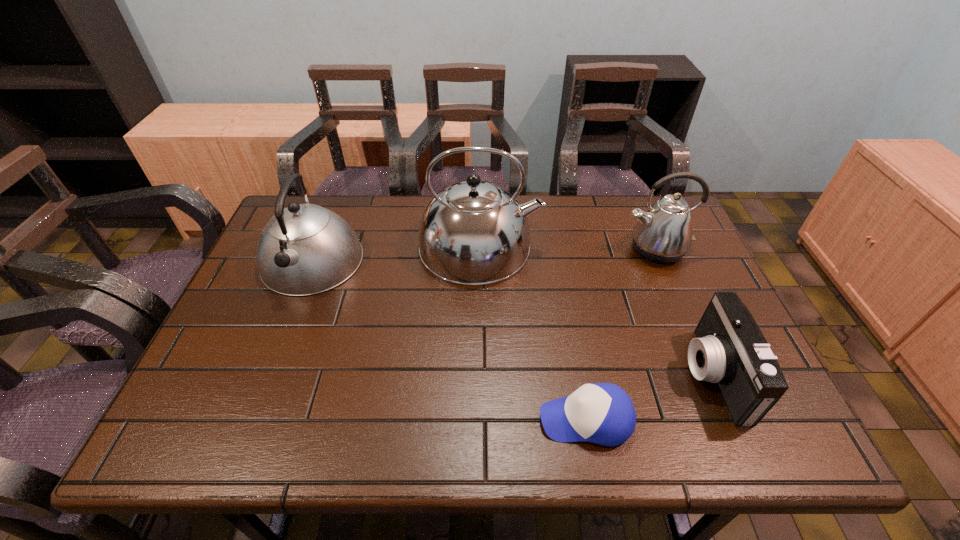
Identify the location of free spot between the leftmost object and the second shortest object. The width and height of the screenshot is (960, 540). (513, 318).

This screenshot has width=960, height=540. What are the coordinates of `unoccupied position between the rightmost kettle and the camcorder` in the screenshot? It's located at pos(684,312).

Locate an element on the screen. free spot between the leftmost kettle and the second shortest object is located at coordinates (513, 318).

This screenshot has height=540, width=960. I want to click on vacant area between the fourth tallest object and the second kettle from right to left, so click(596, 310).

Where is `vacant space that's between the leftmost object and the shortest object`? vacant space that's between the leftmost object and the shortest object is located at coordinates (448, 340).

In order to click on vacant area between the leftmost object and the shortest object in this screenshot , I will do `click(448, 340)`.

The image size is (960, 540). I want to click on free space that is in between the tallest kettle and the rightmost kettle, so click(567, 247).

At what (x,y) coordinates should I click in order to perform the action: click on vacant point located between the shortest object and the second shortest object. Please return your answer as a coordinate pair (x, y). Image resolution: width=960 pixels, height=540 pixels. Looking at the image, I should click on (649, 397).

Where is `unoccupied area between the rightmost kettle and the fourth tallest object`? Image resolution: width=960 pixels, height=540 pixels. unoccupied area between the rightmost kettle and the fourth tallest object is located at coordinates (684, 312).

Locate which object is the third closest to the leftmost kettle. Please provide its 2D coordinates. Your answer should be formatted as a tuple, i.e. [(x, y)], where the tuple contains the x and y coordinates of a point satisfying the conditions above.

[(663, 234)]